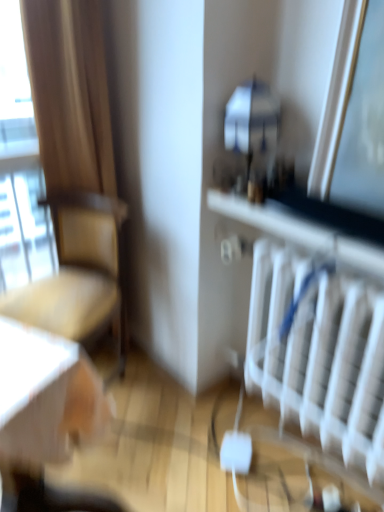
Measure the distance between transparent glass window at left and camera.

transparent glass window at left is 1.44 meters from camera.

Find the location of a particular element. This screenshot has height=512, width=384. white plastic radiator at lower right is located at coordinates (319, 356).

From the image's perspective, would you say white plastic radiator at lower right is positioned over transparent glass window at left?

Incorrect, from the image's perspective, white plastic radiator at lower right is lower than transparent glass window at left.

Is white plastic radiator at lower right inside or outside of transparent glass window at left?

white plastic radiator at lower right cannot be found inside transparent glass window at left.

Is white plastic radiator at lower right taller than transparent glass window at left?

In fact, white plastic radiator at lower right may be shorter than transparent glass window at left.

Does white plastic radiator at lower right have a lesser width compared to transparent glass window at left?

Incorrect, the width of white plastic radiator at lower right is not less than that of transparent glass window at left.

From a real-world perspective, does white plastic radiator at lower right stand above beige fabric chair at left?

Yes, from a real-world perspective, white plastic radiator at lower right is above beige fabric chair at left.

Does white plastic radiator at lower right have a greater width compared to beige fabric chair at left?

No.

How much distance is there between white plastic radiator at lower right and beige fabric chair at left?

white plastic radiator at lower right is 71.27 centimeters away from beige fabric chair at left.

Could beige fabric chair at left be considered to be inside white plastic radiator at lower right?

No.

Is beige fabric chair at left wider than white plastic radiator at lower right?

Yes, beige fabric chair at left is wider than white plastic radiator at lower right.

Is beige fabric chair at left closer to camera compared to white plastic radiator at lower right?

No, beige fabric chair at left is further to the viewer.

Which is in front, point (81, 298) or point (379, 306)?

The point (379, 306) is closer to the camera.

Considering the relative sizes of beige fabric chair at left and white plastic radiator at lower right in the image provided, is beige fabric chair at left bigger than white plastic radiator at lower right?

Indeed, beige fabric chair at left has a larger size compared to white plastic radiator at lower right.

From a real-world perspective, is beige fabric chair at left beneath transparent glass window at left?

Indeed, from a real-world perspective, beige fabric chair at left is positioned beneath transparent glass window at left.

Which object is positioned more to the right, beige fabric chair at left or transparent glass window at left?

From the viewer's perspective, beige fabric chair at left appears more on the right side.

Is beige fabric chair at left facing towards transparent glass window at left?

No.

Consider the image. Choose the correct answer: Is beige fabric chair at left inside transparent glass window at left or outside it?

beige fabric chair at left lies outside transparent glass window at left.

From a real-world perspective, which object stands above the other?

From a 3D spatial view, transparent glass window at left is above.

Is transparent glass window at left wider or thinner than white plastic radiator at lower right?

Considering their sizes, transparent glass window at left looks slimmer than white plastic radiator at lower right.

Locate an element on the screen. The width and height of the screenshot is (384, 512). window on the left of white plastic radiator at lower right is located at coordinates (20, 166).

What's the angular difference between transparent glass window at left and beige fabric chair at left's facing directions?

The angle between the facing direction of transparent glass window at left and the facing direction of beige fabric chair at left is 60 degrees.

Relative to beige fabric chair at left, is transparent glass window at left in front or behind?

Clearly, transparent glass window at left is behind beige fabric chair at left.

Is point (9, 186) closer to camera compared to point (99, 316)?

No.

Is transparent glass window at left wider or thinner than beige fabric chair at left?

In the image, transparent glass window at left appears to be more narrow than beige fabric chair at left.

Locate an element on the screen. The height and width of the screenshot is (512, 384). window above the white plastic radiator at lower right (from the image's perspective) is located at coordinates (20, 166).

Where is `radiator located in front of the beige fabric chair at left`? radiator located in front of the beige fabric chair at left is located at coordinates (319, 356).

From the image, which object appears to be nearer to transparent glass window at left, white plastic radiator at lower right or beige fabric chair at left?

beige fabric chair at left is closer to transparent glass window at left.

When comparing their distances from white plastic radiator at lower right, does transparent glass window at left or beige fabric chair at left seem closer?

Among the two, beige fabric chair at left is located nearer to white plastic radiator at lower right.

Which object lies further to the anchor point transparent glass window at left, beige fabric chair at left or white plastic radiator at lower right?

Based on the image, white plastic radiator at lower right appears to be further to transparent glass window at left.

Estimate the real-world distances between objects in this image. Which object is closer to beige fabric chair at left, white plastic radiator at lower right or transparent glass window at left?

transparent glass window at left lies closer to beige fabric chair at left than the other object.

From the picture: Which object lies nearer to the anchor point white plastic radiator at lower right, beige fabric chair at left or transparent glass window at left?

The object closer to white plastic radiator at lower right is beige fabric chair at left.

Looking at the image, which one is located further to beige fabric chair at left, transparent glass window at left or white plastic radiator at lower right?

white plastic radiator at lower right lies further to beige fabric chair at left than the other object.

The width and height of the screenshot is (384, 512). Identify the location of chair situated between transparent glass window at left and white plastic radiator at lower right from left to right. (77, 273).